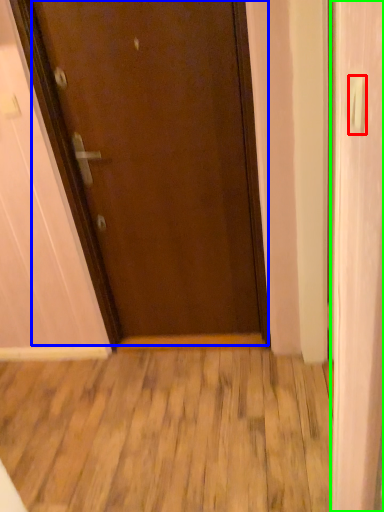
Question: Estimate the real-world distances between objects in this image. Which object is closer to door handle (highlighted by a red box), door (highlighted by a blue box) or screen door (highlighted by a green box)?

Choices:
 (A) door
 (B) screen door

Answer: (B)